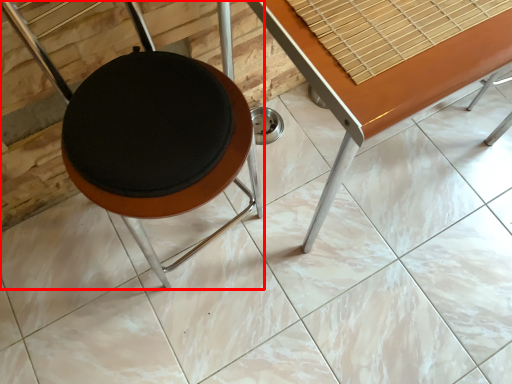
Question: From the image's perspective, where is furniture (annotated by the red box) located in relation to table in the image?

Choices:
 (A) above
 (B) below

Answer: (B)